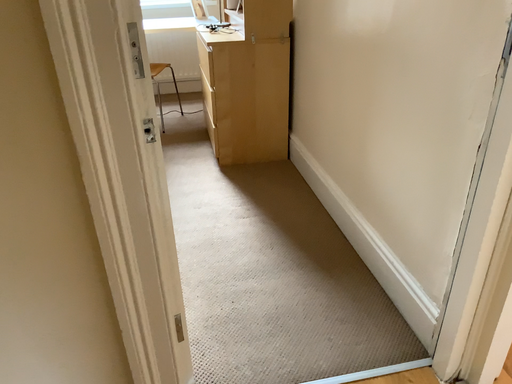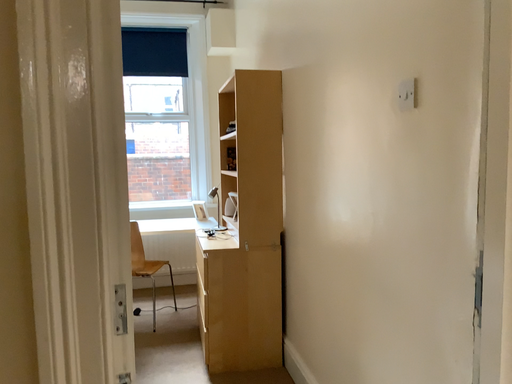
Question: How did the camera likely rotate when shooting the video?

Choices:
 (A) rotated upward
 (B) rotated downward

Answer: (A)